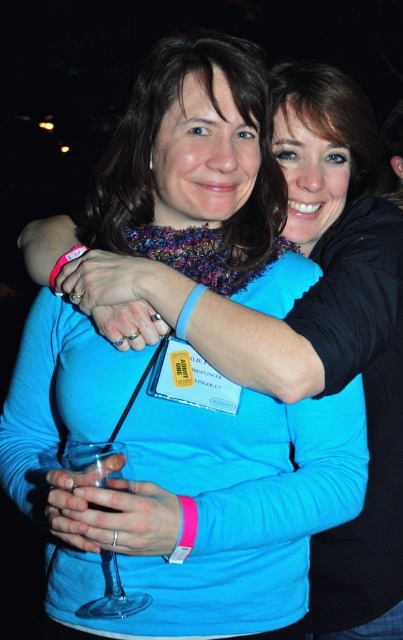
Question: Which point is closer to the camera?

Choices:
 (A) (398, 189)
 (B) (267, 241)

Answer: (B)

Question: Is knitted scarf at center smaller than transparent glass wine glass at lower left?

Choices:
 (A) no
 (B) yes

Answer: (A)

Question: Which point is farther to the camera?

Choices:
 (A) (265, 186)
 (B) (112, 584)

Answer: (A)

Question: Is knitted scarf at center wider than matte black hair at upper center?

Choices:
 (A) yes
 (B) no

Answer: (A)

Question: Which point is closer to the camera?

Choices:
 (A) matte black hair at upper center
 (B) knitted scarf at center

Answer: (B)

Question: Can you confirm if knitted scarf at center is positioned to the left of matte black hair at upper center?

Choices:
 (A) no
 (B) yes

Answer: (B)